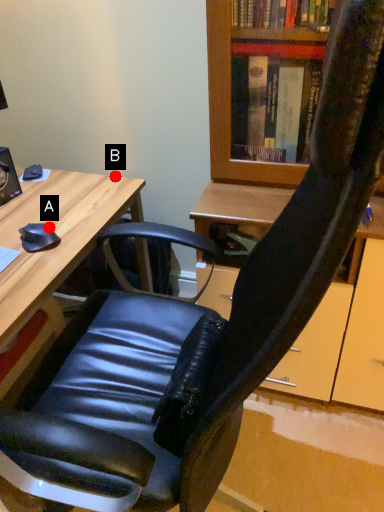
Question: Two points are circled on the image, labeled by A and B beside each circle. Which of the following is the farthest from the observer?

Choices:
 (A) A is further
 (B) B is further

Answer: (B)